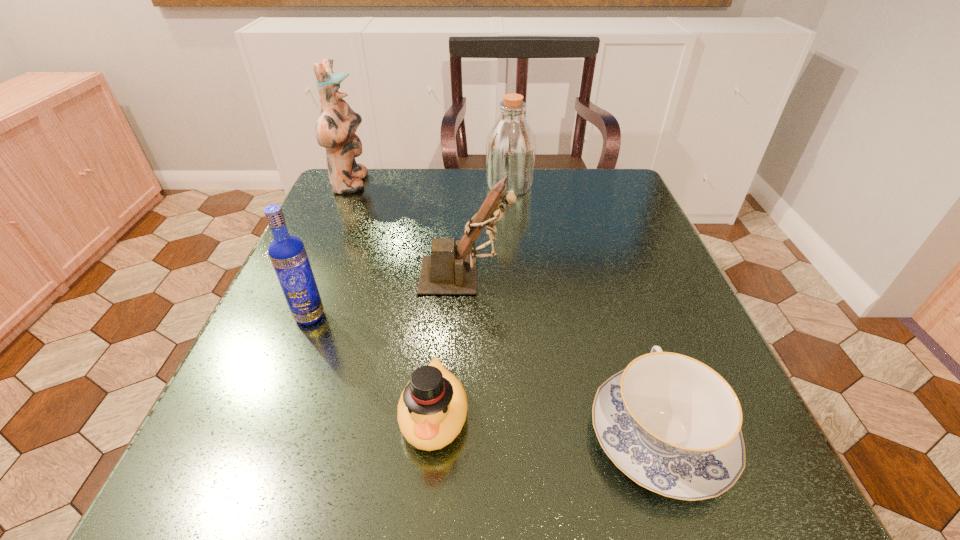
Locate an element on the screen. vacant space located 0.180m on the left of the bottle is located at coordinates (414, 186).

The height and width of the screenshot is (540, 960). I want to click on free spot located 0.230m on the front of the fourth farthest object, so click(252, 458).

The height and width of the screenshot is (540, 960). What are the coordinates of `free space located 0.160m on the front-facing side of the nearer figurine` in the screenshot? It's located at (595, 276).

Find the location of a particular element. This screenshot has height=540, width=960. vacant area situated 0.260m with the handle on the side of the shortest object is located at coordinates (604, 267).

Locate an element on the screen. This screenshot has height=540, width=960. vacant space located 0.340m with the handle on the side of the shortest object is located at coordinates (596, 242).

You are a GUI agent. You are given a task and a screenshot of the screen. Output one action in this format:
    pyautogui.click(x=<x>, y=<y>)
    Task: Click on the free space located with the handle on the side of the shortest object
    
    Given the screenshot: What is the action you would take?
    pyautogui.click(x=591, y=229)

Find the location of a particular element. figurine that is at the far edge is located at coordinates (335, 129).

Where is `bottle at the far edge`? Image resolution: width=960 pixels, height=540 pixels. bottle at the far edge is located at coordinates (511, 146).

The image size is (960, 540). What are the coordinates of `duck that is positioned at the near edge` in the screenshot? It's located at (432, 409).

I want to click on chinaware that is at the near edge, so click(x=672, y=424).